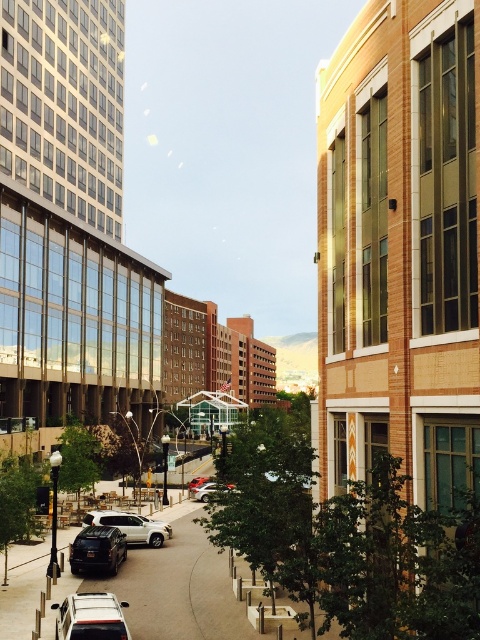
You are standing at the center of the street and see the point at coordinates point (91, 616). Based on the scene description, which object is this point located on?

The point (91, 616) is located on the silver metallic suv at lower left.

You are a delivery driver who needs to park your vehicle in a tight space that can only accommodate cars narrower than 1.8 meters. You see the silver metallic suv at lower left and the white matte suv at center. Which vehicle should you choose to park in the space?

The silver metallic suv at lower left has a width less than the white matte suv at center, so you should choose the silver metallic suv at lower left to park in the space since it is narrower than 1.8 meters.